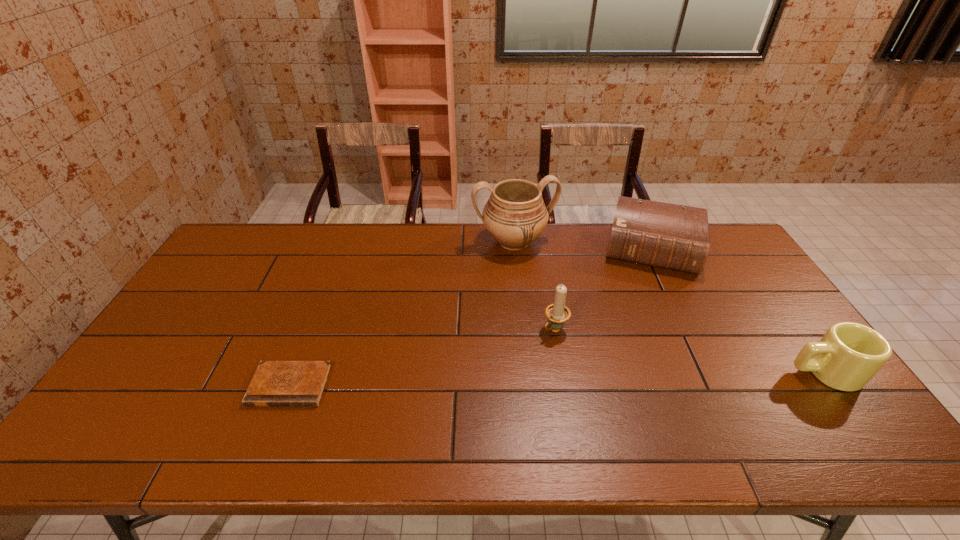
This screenshot has height=540, width=960. I want to click on blank space at the right edge of the desktop, so click(x=727, y=285).

This screenshot has width=960, height=540. In the image, there is a desktop. What are the coordinates of `vacant space at the far right corner` in the screenshot? It's located at (722, 254).

This screenshot has height=540, width=960. What are the coordinates of `vacant space that is in between the urn and the leftmost object` in the screenshot? It's located at (402, 313).

Identify the location of vacant area that lies between the diary and the tallest object. (402, 313).

Find the location of a particular element. The image size is (960, 540). free spot between the fourth shortest object and the rightmost object is located at coordinates (689, 351).

Identify the location of vacant space that is in between the urn and the candle_holder. This screenshot has height=540, width=960. (535, 285).

The width and height of the screenshot is (960, 540). Identify the location of free spot between the fourth shortest object and the tallest object. (535, 285).

The width and height of the screenshot is (960, 540). In order to click on free space between the leftmost object and the urn in this screenshot , I will do `click(402, 313)`.

Locate an element on the screen. The height and width of the screenshot is (540, 960). vacant space that's between the tallest object and the shortest object is located at coordinates (402, 313).

Image resolution: width=960 pixels, height=540 pixels. In order to click on free point between the fourth shortest object and the diary in this screenshot , I will do `click(422, 357)`.